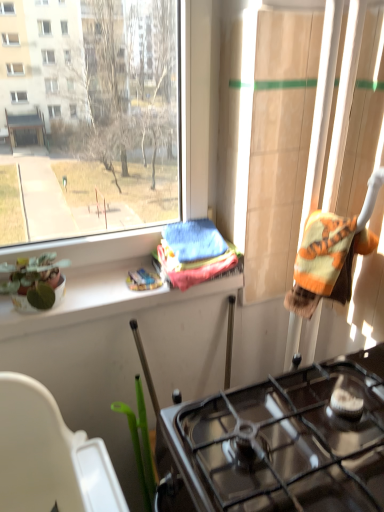
Question: Is black glass gas stove at lower center aimed at green matte plant pot at left?

Choices:
 (A) yes
 (B) no

Answer: (B)

Question: From the image's perspective, is black glass gas stove at lower center on top of green matte plant pot at left?

Choices:
 (A) yes
 (B) no

Answer: (B)

Question: Is black glass gas stove at lower center surrounding green matte plant pot at left?

Choices:
 (A) no
 (B) yes

Answer: (A)

Question: Is black glass gas stove at lower center shorter than green matte plant pot at left?

Choices:
 (A) yes
 (B) no

Answer: (B)

Question: From a real-world perspective, is black glass gas stove at lower center under green matte plant pot at left?

Choices:
 (A) yes
 (B) no

Answer: (A)

Question: Would you say green glossy plant pot at lower left is to the left or to the right of green matte plant pot at left in the picture?

Choices:
 (A) right
 (B) left

Answer: (B)

Question: From their relative heights in the image, would you say green glossy plant pot at lower left is taller or shorter than green matte plant pot at left?

Choices:
 (A) short
 (B) tall

Answer: (B)

Question: Relative to green matte plant pot at left, is green glossy plant pot at lower left in front or behind?

Choices:
 (A) behind
 (B) front

Answer: (B)

Question: Considering the positions of green glossy plant pot at lower left and green matte plant pot at left in the image, is green glossy plant pot at lower left wider or thinner than green matte plant pot at left?

Choices:
 (A) thin
 (B) wide

Answer: (A)

Question: In the image, is transparent glass window at center positioned in front of or behind black glass gas stove at lower center?

Choices:
 (A) behind
 (B) front

Answer: (A)

Question: Is point (51, 152) positioned closer to the camera than point (370, 502)?

Choices:
 (A) closer
 (B) farther

Answer: (B)

Question: Visually, is transparent glass window at center positioned to the left or to the right of black glass gas stove at lower center?

Choices:
 (A) right
 (B) left

Answer: (B)

Question: Is transparent glass window at center taller or shorter than black glass gas stove at lower center?

Choices:
 (A) short
 (B) tall

Answer: (B)

Question: From their relative heights in the image, would you say green glossy plant pot at lower left is taller or shorter than black glass gas stove at lower center?

Choices:
 (A) short
 (B) tall

Answer: (A)

Question: From a real-world perspective, is green glossy plant pot at lower left above or below black glass gas stove at lower center?

Choices:
 (A) above
 (B) below

Answer: (A)